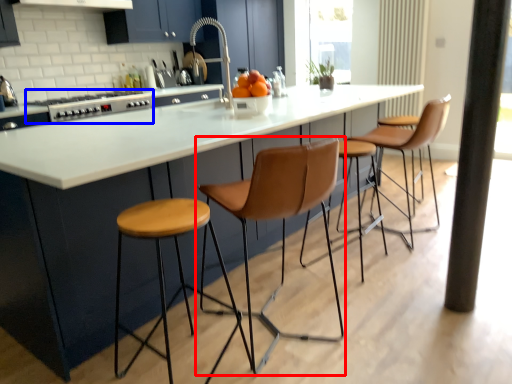
Question: Among these objects, which one is farthest to the camera, chair (highlighted by a red box) or appliance (highlighted by a blue box)?

Choices:
 (A) chair
 (B) appliance

Answer: (B)